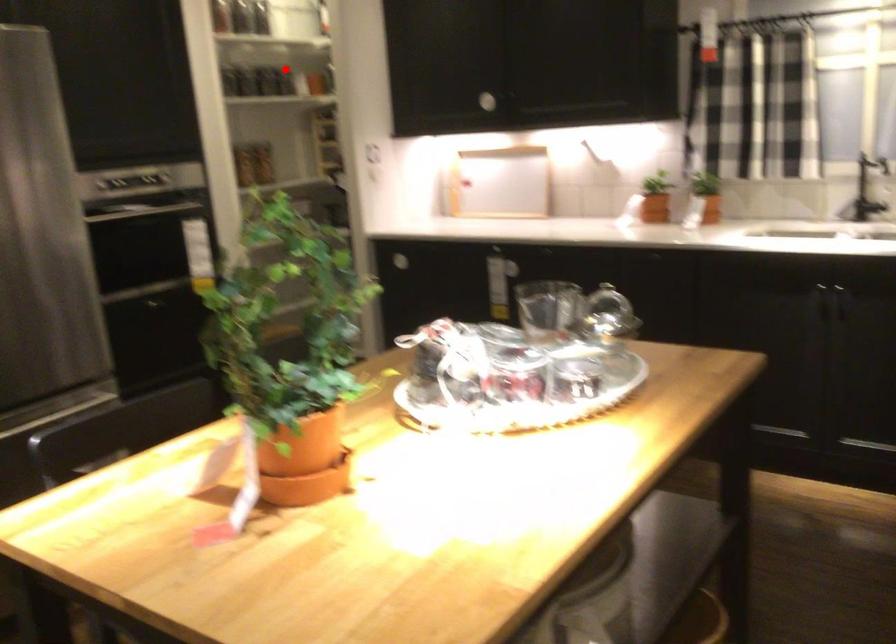
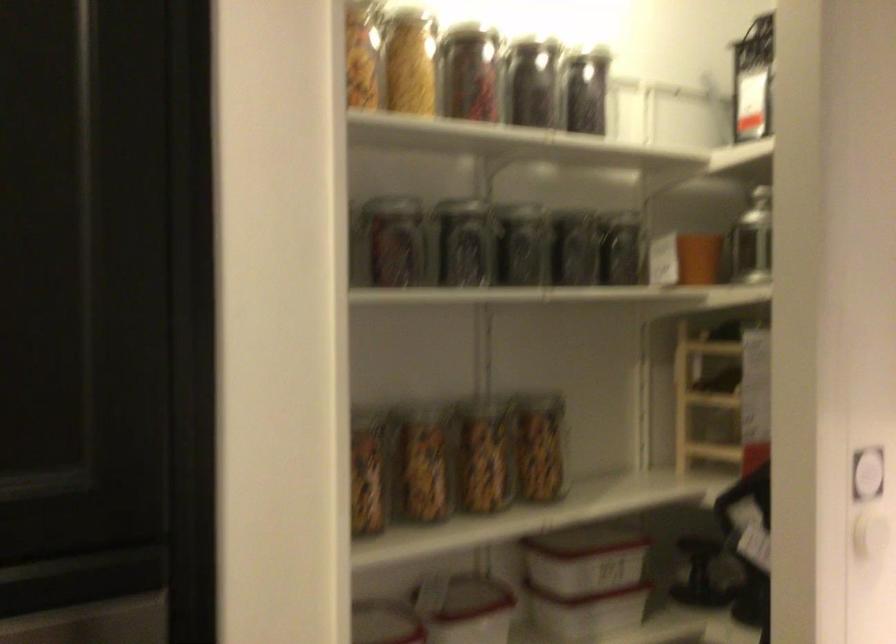
The point at the highlighted location is marked in the first image. Where is the corresponding point in the second image?

(622, 249)